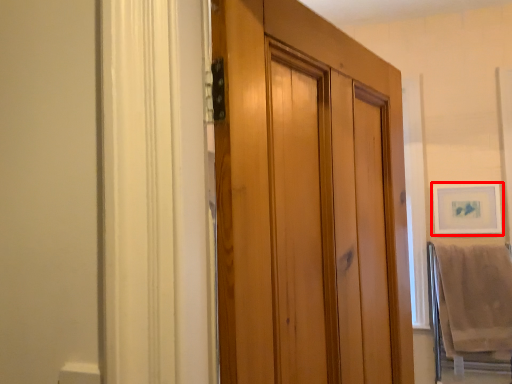
Question: From the image's perspective, what is the correct spatial positioning of picture frame (annotated by the red box) in reference to bath towel?

Choices:
 (A) below
 (B) above

Answer: (B)